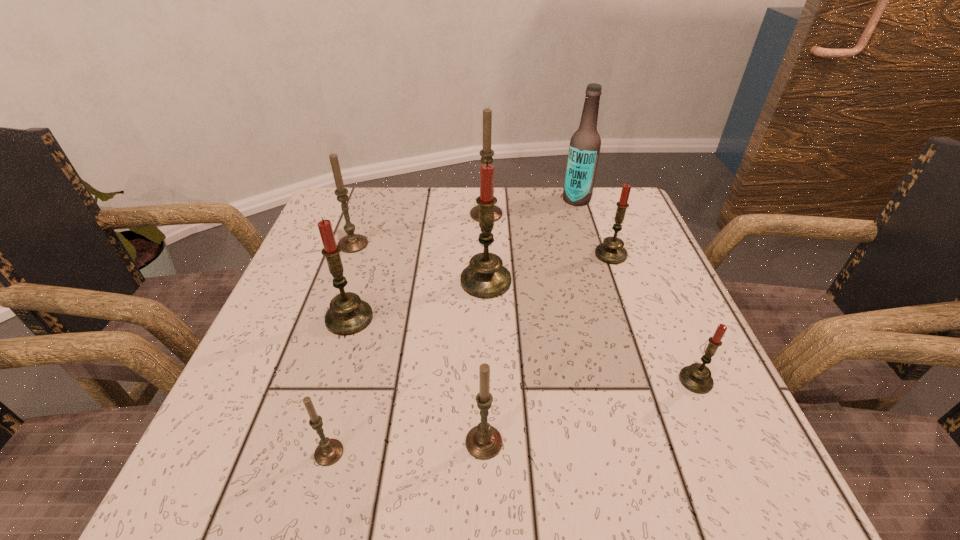
You are a GUI agent. You are given a task and a screenshot of the screen. Output one action in this format:
    pyautogui.click(x=<x>, y=<y>)
    Task: Click on the vacant area between the leftmost gray candle and the farthest red candle
    This screenshot has height=540, width=960.
    Given the screenshot: What is the action you would take?
    pyautogui.click(x=482, y=249)

Where is `vacant area between the farthest candle and the leftmost red candle`? The width and height of the screenshot is (960, 540). vacant area between the farthest candle and the leftmost red candle is located at coordinates (418, 266).

At what (x,y) coordinates should I click in order to perform the action: click on free space between the second red candle from left to right and the third smallest red candle. Please return your answer as a coordinate pair (x, y). This screenshot has width=960, height=540. Looking at the image, I should click on (418, 300).

What are the coordinates of `vacant space that is in between the leftmost gray candle and the beer bottle` in the screenshot? It's located at (465, 222).

Identify which object is the sixth closest to the third red candle from left to right. Please provide its 2D coordinates. Your answer should be formatted as a tuple, i.e. [(x, y)], where the tuple contains the x and y coordinates of a point satisfying the conditions above.

[(348, 314)]

Find the location of a particular element. This screenshot has height=540, width=960. the closest object relative to the fifth nearest object is located at coordinates (486, 153).

Locate an element on the screen. Image resolution: width=960 pixels, height=540 pixels. the fifth closest candle relative to the farthest gray candle is located at coordinates (696, 378).

Where is `the sixth closest candle to the second smallest red candle`? The width and height of the screenshot is (960, 540). the sixth closest candle to the second smallest red candle is located at coordinates (352, 243).

Select which red candle appears as the second closest to the farthest red candle. Please provide its 2D coordinates. Your answer should be formatted as a tuple, i.e. [(x, y)], where the tuple contains the x and y coordinates of a point satisfying the conditions above.

[(696, 378)]

Locate an element on the screen. The width and height of the screenshot is (960, 540). red candle that is the second closest one to the third smallest red candle is located at coordinates click(x=611, y=251).